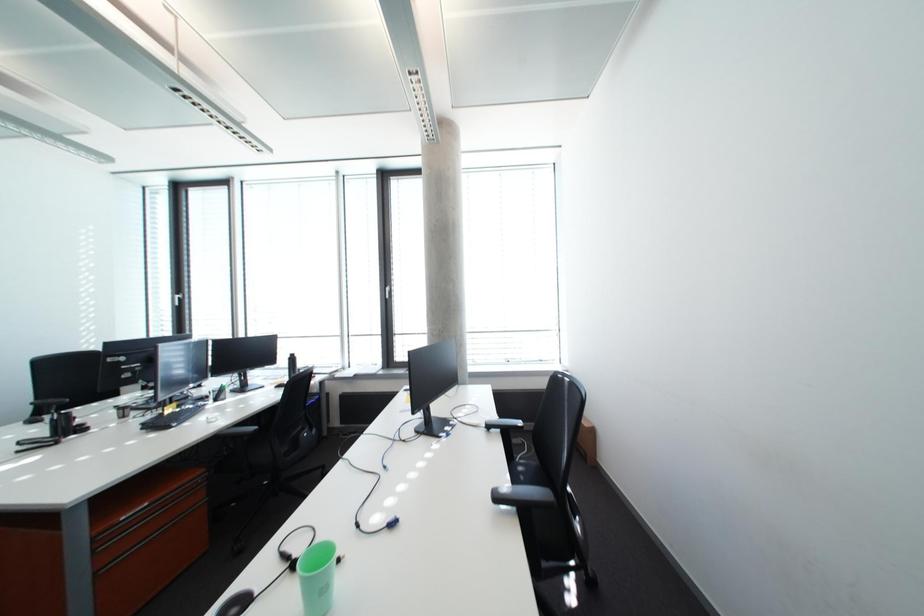
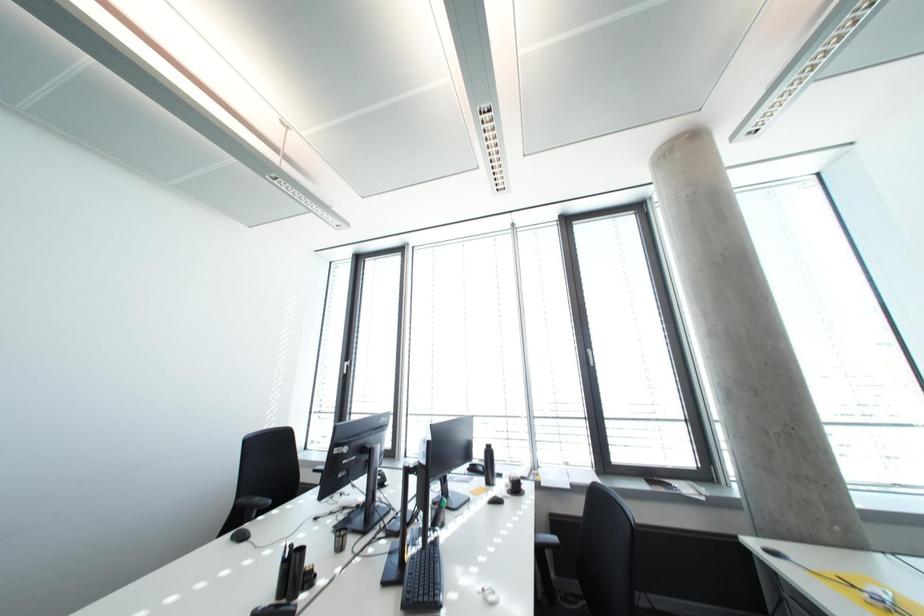
Question: In a continuous first-person perspective shot, in which direction is the camera moving?

Choices:
 (A) Left
 (B) Right
 (C) Forward
 (D) Backward

Answer: (A)